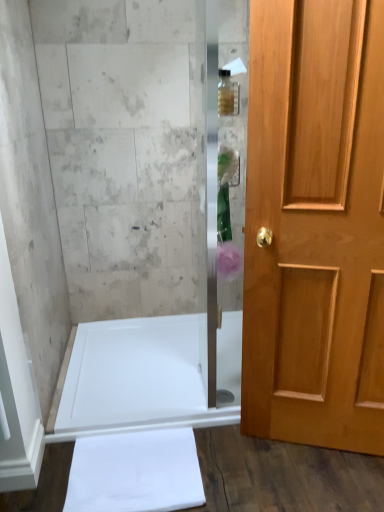
Question: Is translucent glass bottle at upper center with light brown wooden door at right?

Choices:
 (A) no
 (B) yes

Answer: (A)

Question: Considering the relative positions of translucent glass bottle at upper center and light brown wooden door at right in the image provided, is translucent glass bottle at upper center behind light brown wooden door at right?

Choices:
 (A) no
 (B) yes

Answer: (B)

Question: Is translucent glass bottle at upper center far away from light brown wooden door at right?

Choices:
 (A) no
 (B) yes

Answer: (A)

Question: Does translucent glass bottle at upper center have a greater height compared to light brown wooden door at right?

Choices:
 (A) no
 (B) yes

Answer: (A)

Question: Is translucent glass bottle at upper center turned away from light brown wooden door at right?

Choices:
 (A) no
 (B) yes

Answer: (A)

Question: From a real-world perspective, does translucent glass bottle at upper center stand above light brown wooden door at right?

Choices:
 (A) yes
 (B) no

Answer: (A)

Question: Does translucent glass bottle at upper center appear on the right side of translucent pink flower at center?

Choices:
 (A) yes
 (B) no

Answer: (B)

Question: Is translucent glass bottle at upper center smaller than translucent pink flower at center?

Choices:
 (A) yes
 (B) no

Answer: (A)

Question: Can you confirm if translucent glass bottle at upper center is thinner than translucent pink flower at center?

Choices:
 (A) yes
 (B) no

Answer: (B)

Question: Does translucent glass bottle at upper center have a greater height compared to translucent pink flower at center?

Choices:
 (A) no
 (B) yes

Answer: (A)

Question: Is translucent glass bottle at upper center placed right next to translucent pink flower at center?

Choices:
 (A) no
 (B) yes

Answer: (A)

Question: Is there a large distance between translucent glass bottle at upper center and translucent pink flower at center?

Choices:
 (A) yes
 (B) no

Answer: (B)

Question: Is translucent glass bottle at upper center positioned with its back to white glossy bathtub at lower left?

Choices:
 (A) no
 (B) yes

Answer: (A)